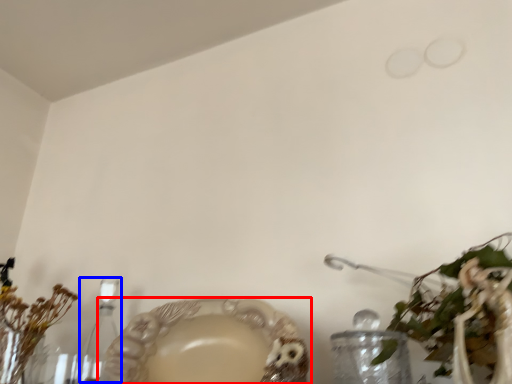
Question: Which object is closer to the camera taking this photo, tableware (highlighted by a red box) or candle holder (highlighted by a blue box)?

Choices:
 (A) tableware
 (B) candle holder

Answer: (A)